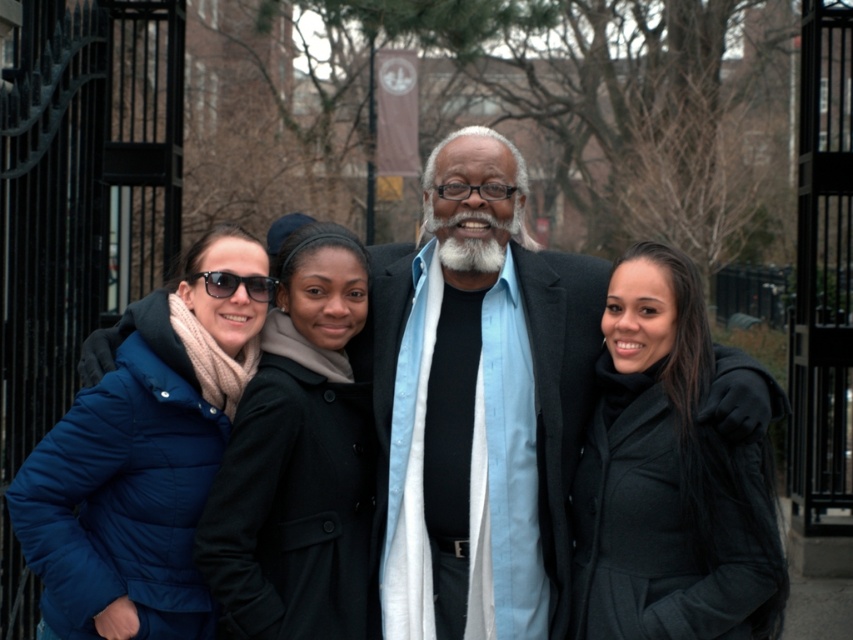
You are a photographer trying to capture a clear shot of the light blue fabric shirt at center and the blue puffer jacket at left. Since the camera can only focus on one object at a time, which object should you choose to ensure it fills the frame more effectively?

The light blue fabric shirt at center is larger in size than the blue puffer jacket at left, so choosing to focus on the light blue fabric shirt at center would allow it to fill the frame more effectively.

You are a photographer trying to capture a closeup shot of the white soft beard at center and the matte black sunglasses at left. From the photographer perspective, which object is positioned to the right?

The white soft beard at center is positioned to the right of the matte black sunglasses at left.

You are a photographer trying to capture a closeup shot of the white soft beard at center and the matte black sunglasses at left. Which object should you zoom in on first if you want to focus on the wider one?

The matte black sunglasses at left is wider than the white soft beard at center, so you should zoom in on the matte black sunglasses at left first if you want to focus on the wider one.